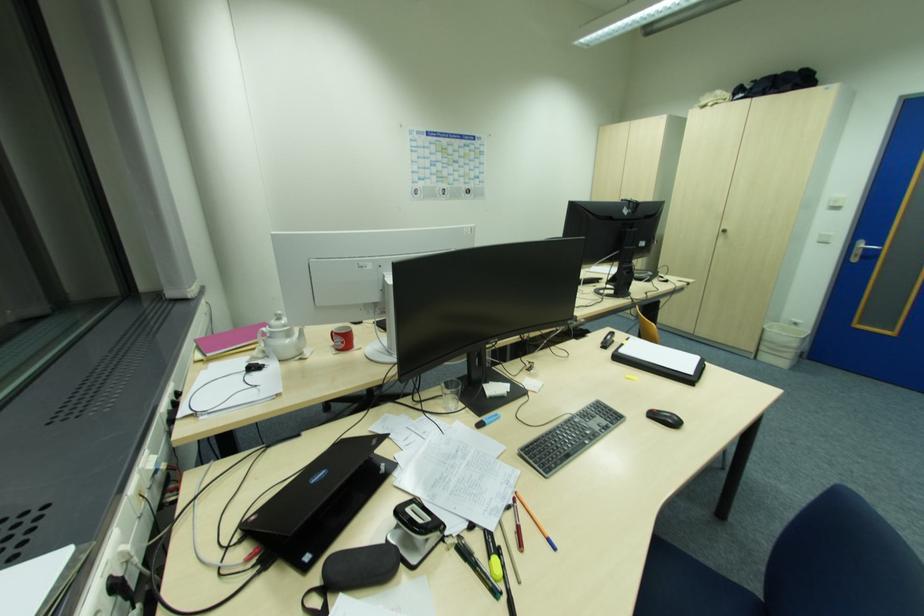
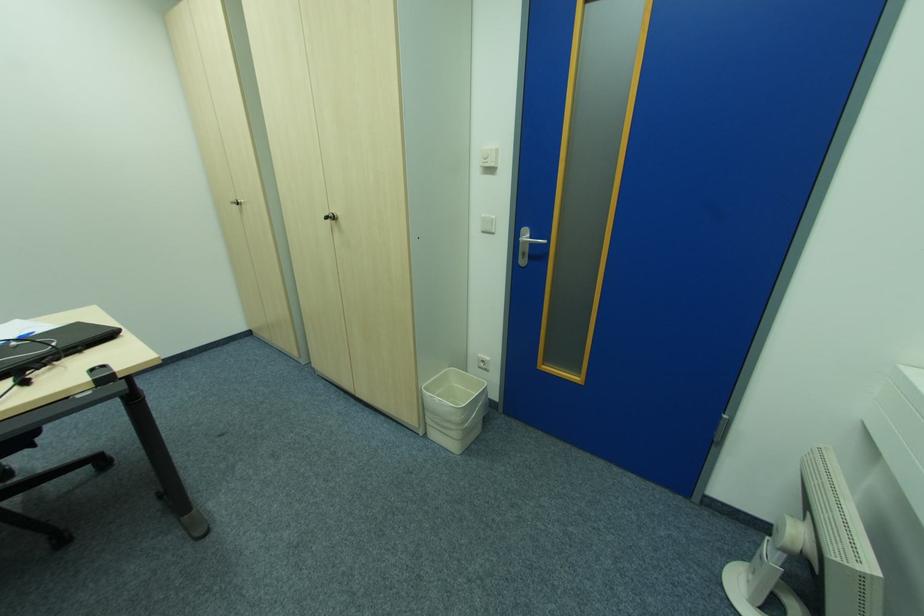
In the second image, find the point that corresponds to (x=766, y=330) in the first image.

(424, 391)